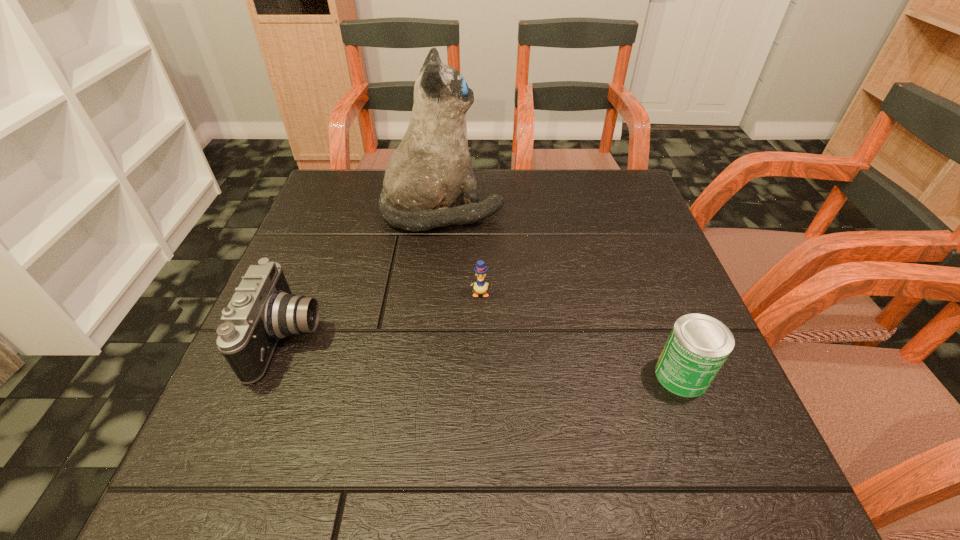
Where is `the farthest object`? The height and width of the screenshot is (540, 960). the farthest object is located at coordinates (429, 171).

Identify the location of cat. (429, 171).

This screenshot has height=540, width=960. Find the location of `the third shortest object`. the third shortest object is located at coordinates (263, 310).

At what (x,y) coordinates should I click in order to perform the action: click on the leftmost object. Please return your answer as a coordinate pair (x, y). The height and width of the screenshot is (540, 960). Looking at the image, I should click on (263, 310).

Where is `the second shortest object`? The width and height of the screenshot is (960, 540). the second shortest object is located at coordinates (698, 345).

Locate an element on the screen. This screenshot has width=960, height=540. can is located at coordinates click(x=698, y=345).

Find the location of a particular element. Image resolution: width=960 pixels, height=540 pixels. duckling is located at coordinates (480, 287).

I want to click on free spot located at the face of the cat, so click(x=578, y=211).

Where is `vacant region located on the front-facing side of the second tallest object`? This screenshot has width=960, height=540. vacant region located on the front-facing side of the second tallest object is located at coordinates (456, 338).

Locate an element on the screen. vacant point located on the back of the third tallest object is located at coordinates (625, 228).